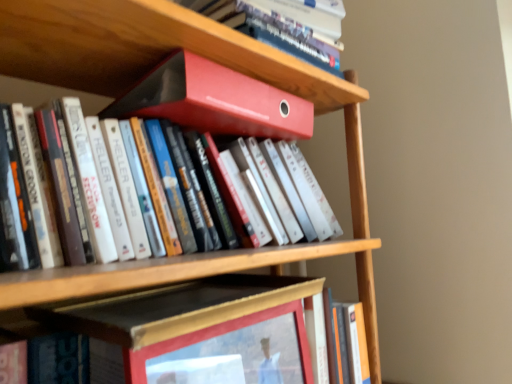
Question: Considering their positions, is matte red binder at upper center, arranged as the second book when viewed from the top, located in front of or behind wooden picture frame at center?

Choices:
 (A) behind
 (B) front

Answer: (A)

Question: Considering the positions of matte red binder at upper center, the 4th book positioned from the bottom, and wooden picture frame at center in the image, is matte red binder at upper center, the 4th book positioned from the bottom, bigger or smaller than wooden picture frame at center?

Choices:
 (A) small
 (B) big

Answer: (B)

Question: Which object is positioned closest to the matte red binder at upper center, the 3th book viewed from the top?

Choices:
 (A) matte plastic file at upper center
 (B) matte black frame at center, the 4th book positioned from the top
 (C) orange matte book at lower right, which appears as the fifth book when viewed from the top
 (D) matte red binder at upper center, arranged as the second book when viewed from the top
 (E) matte red folder at upper center, which is the fifth book from bottom to top

Answer: (D)

Question: Estimate the real-world distances between objects in this image. Which object is closer to the matte red binder at upper center, the third book in the bottom-to-top sequence?

Choices:
 (A) matte red folder at upper center, placed as the first book when sorted from top to bottom
 (B) matte plastic file at upper center
 (C) matte black frame at center, the 4th book positioned from the top
 (D) wooden picture frame at center
 (E) orange matte book at lower right, which appears as the fifth book when viewed from the top

Answer: (C)